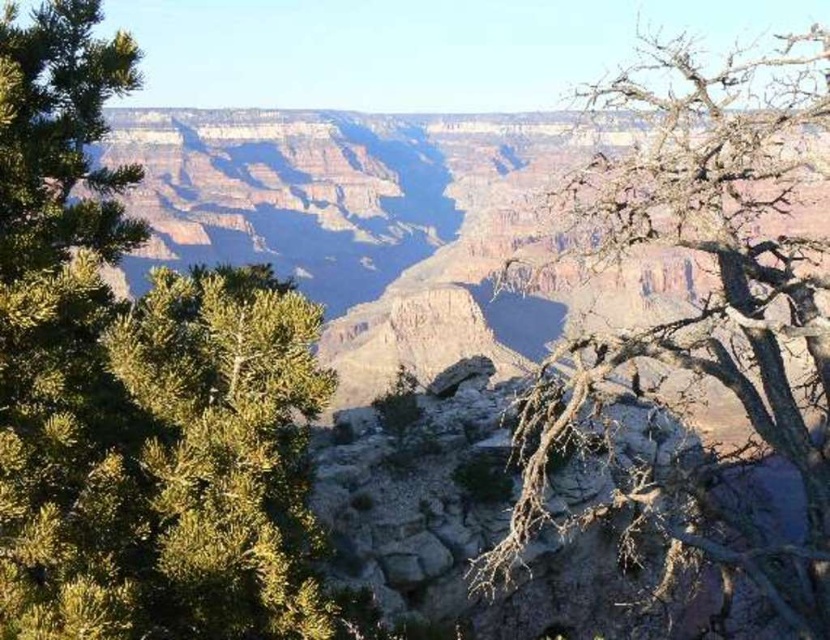
Question: Among these objects, which one is farthest from the camera?

Choices:
 (A) green leafy tree at left
 (B) bare branches at right

Answer: (B)

Question: Is green leafy tree at left positioned in front of bare branches at right?

Choices:
 (A) yes
 (B) no

Answer: (A)

Question: Can you confirm if green leafy tree at left is bigger than bare branches at right?

Choices:
 (A) yes
 (B) no

Answer: (B)

Question: Is green leafy tree at left to the right of bare branches at right from the viewer's perspective?

Choices:
 (A) yes
 (B) no

Answer: (B)

Question: Which of the following is the closest to the observer?

Choices:
 (A) (770, 298)
 (B) (142, 561)

Answer: (B)